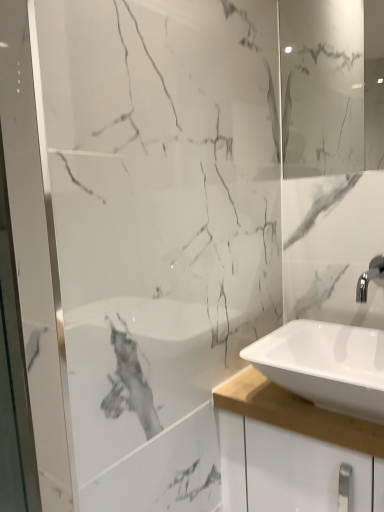
Question: Based on their positions, is white glossy mirror at upper right located to the left or right of white glossy sink at lower right?

Choices:
 (A) left
 (B) right

Answer: (B)

Question: From their relative heights in the image, would you say white glossy mirror at upper right is taller or shorter than white glossy sink at lower right?

Choices:
 (A) tall
 (B) short

Answer: (A)

Question: Does point (355, 108) appear closer or farther from the camera than point (311, 335)?

Choices:
 (A) closer
 (B) farther

Answer: (B)

Question: Visually, is white glossy sink at lower right positioned to the left or to the right of white glossy mirror at upper right?

Choices:
 (A) right
 (B) left

Answer: (B)

Question: Considering the positions of white glossy sink at lower right and white glossy mirror at upper right in the image, is white glossy sink at lower right taller or shorter than white glossy mirror at upper right?

Choices:
 (A) tall
 (B) short

Answer: (B)

Question: Based on their sizes in the image, would you say white glossy sink at lower right is bigger or smaller than white glossy mirror at upper right?

Choices:
 (A) small
 (B) big

Answer: (B)

Question: From a real-world perspective, relative to white glossy mirror at upper right, is white glossy sink at lower right vertically above or below?

Choices:
 (A) below
 (B) above

Answer: (A)